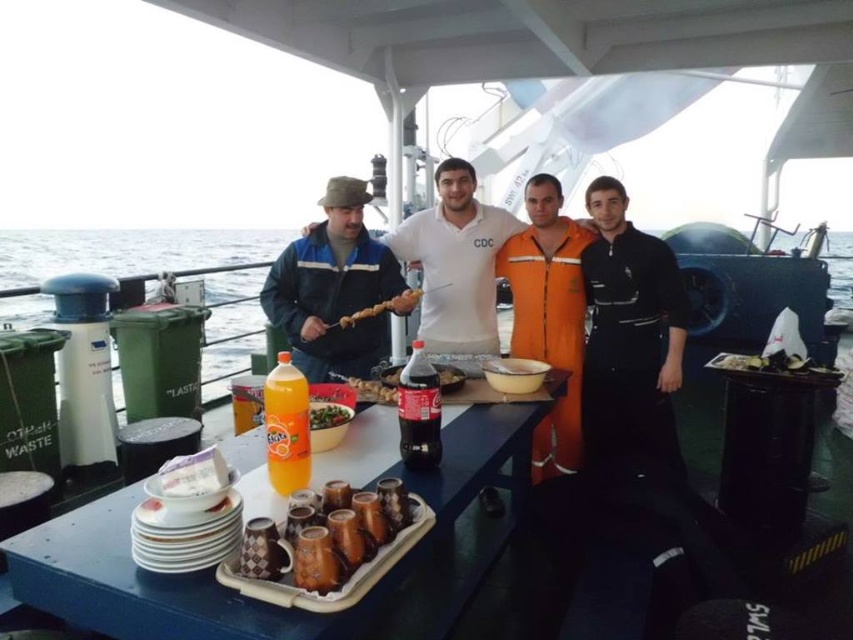
You are a passenger on the ship and you want to get a drink from the translucent plastic bottle at center. The brown ceramic mug at center is in your way. Can you move the mug to access the bottle?

The brown ceramic mug at center is positioned under the translucent plastic bottle at center, so you can move the mug to access the bottle.

You are a chef on the ship and need to place the green leafy vegetables at center onto the blue plastic table at center. Can you do this without moving the table?

The blue plastic table at center is below green leafy vegetables at center, so yes, the chef can place the green leafy vegetables at center onto the blue plastic table at center by simply lowering them down since the table is already positioned underneath.